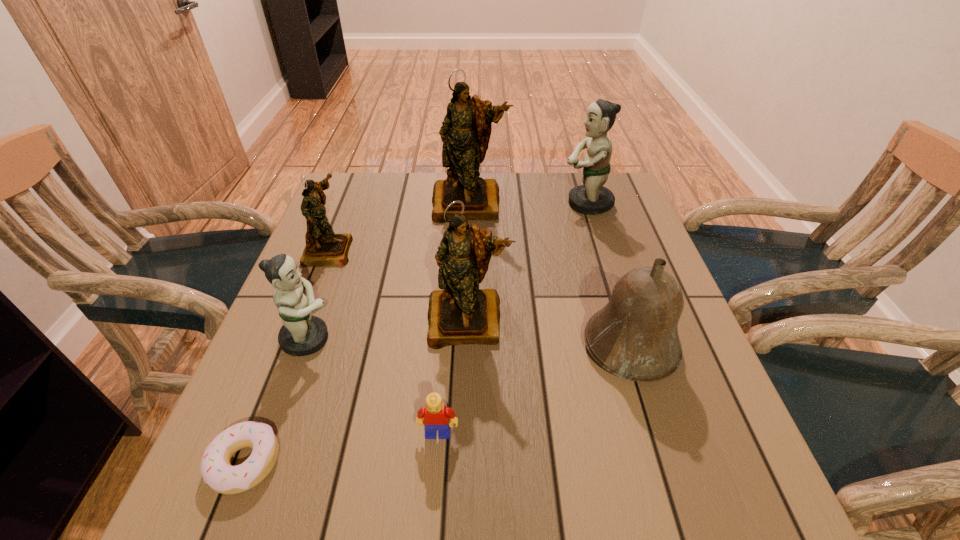
What are the coordinates of `the tallest figurine` in the screenshot? It's located at (466, 129).

At what (x,y) coordinates should I click in order to perform the action: click on the farthest gold figurine. Please return your answer as a coordinate pair (x, y). Looking at the image, I should click on (466, 129).

Locate an element on the screen. the bigger green figurine is located at coordinates (592, 197).

Where is `the farther green figurine`? Image resolution: width=960 pixels, height=540 pixels. the farther green figurine is located at coordinates (592, 197).

I want to click on the second biggest gold figurine, so click(x=462, y=313).

Identify the location of bell. This screenshot has height=540, width=960. (635, 336).

You are a GUI agent. You are given a task and a screenshot of the screen. Output one action in this format:
    pyautogui.click(x=<x>, y=<y>)
    Task: Click on the third farthest figurine
    Image resolution: width=960 pixels, height=540 pixels.
    Given the screenshot: What is the action you would take?
    pyautogui.click(x=323, y=247)

I want to click on the sixth nearest object, so coord(323,247).

At what (x,y) coordinates should I click in order to perform the action: click on the left green figurine. Please return your answer as a coordinate pair (x, y). This screenshot has height=540, width=960. Looking at the image, I should click on pyautogui.click(x=302, y=334).

At what (x,y) coordinates should I click in order to perform the action: click on the smaller green figurine. Please return your answer as a coordinate pair (x, y). This screenshot has width=960, height=540. Looking at the image, I should click on (302, 334).